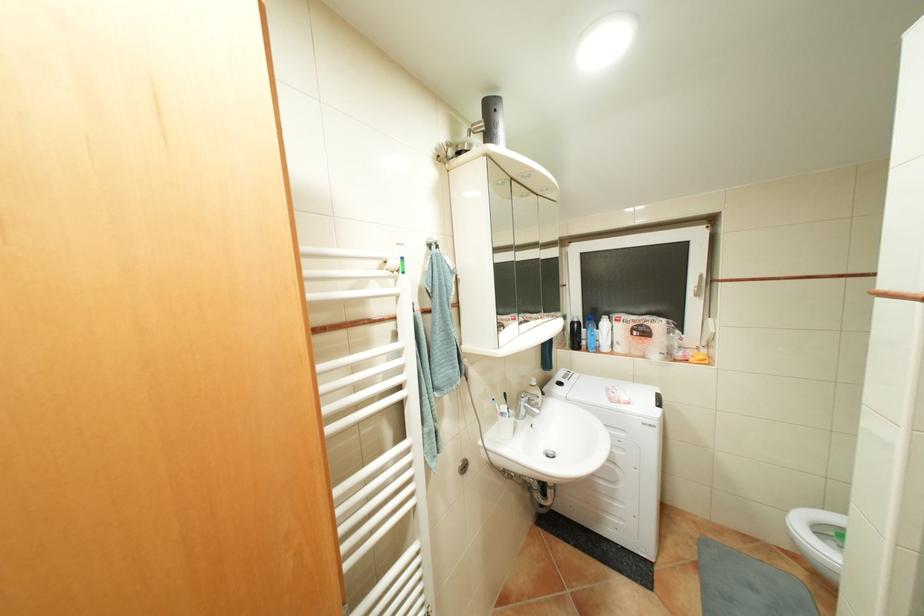
What do you see at coordinates (492, 120) in the screenshot? I see `the air freshener lever` at bounding box center [492, 120].